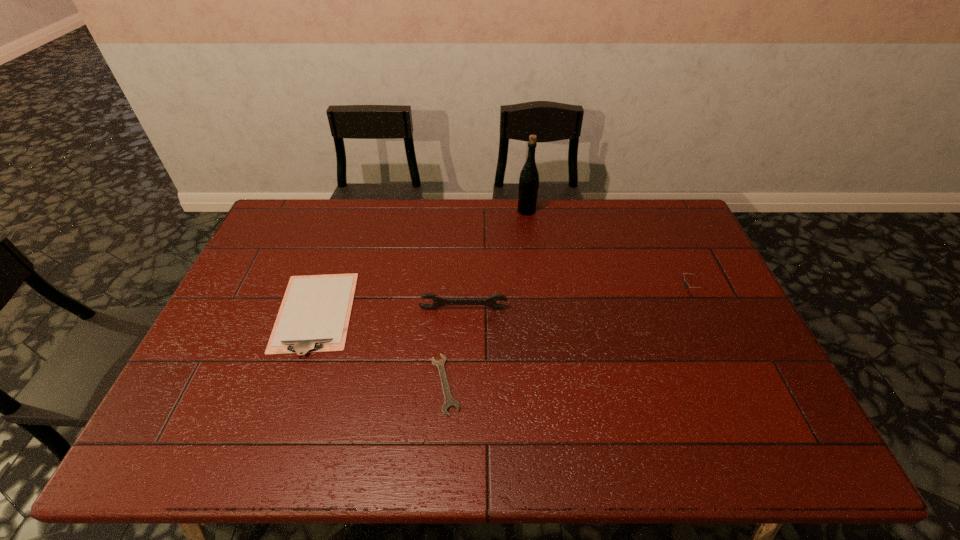
In the image, there is a desktop. Where is `vacant space at the right edge`? The image size is (960, 540). vacant space at the right edge is located at coordinates (729, 313).

Image resolution: width=960 pixels, height=540 pixels. I want to click on empty space between the rightmost object and the clipboard, so click(x=502, y=303).

In order to click on free space between the farthest object and the second shortest object in this screenshot , I will do `click(420, 262)`.

Find the location of a particular element. The image size is (960, 540). vacant space in between the second shortest object and the sunglasses is located at coordinates (502, 303).

Locate an element on the screen. vacant area that lies between the rightmost object and the taller wrench is located at coordinates (576, 301).

I want to click on vacant space that's between the second shortest object and the shortest object, so click(380, 349).

The width and height of the screenshot is (960, 540). I want to click on vacant region between the taller wrench and the beer bottle, so click(x=494, y=260).

The width and height of the screenshot is (960, 540). Identify the location of empty space between the nearer wrench and the rightmost object. (567, 338).

This screenshot has width=960, height=540. I want to click on vacant area between the clipboard and the farther wrench, so click(x=389, y=311).

In order to click on free space that is in between the tallest object and the nearer wrench in this screenshot , I will do `click(486, 298)`.